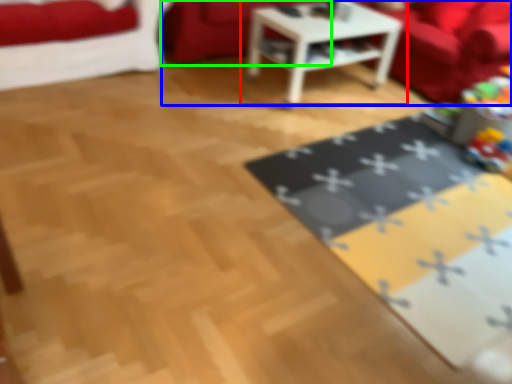
Question: Which is farther away from table (highlighted by a red box)? couch (highlighted by a blue box) or couch (highlighted by a green box)?

Choices:
 (A) couch
 (B) couch

Answer: (A)